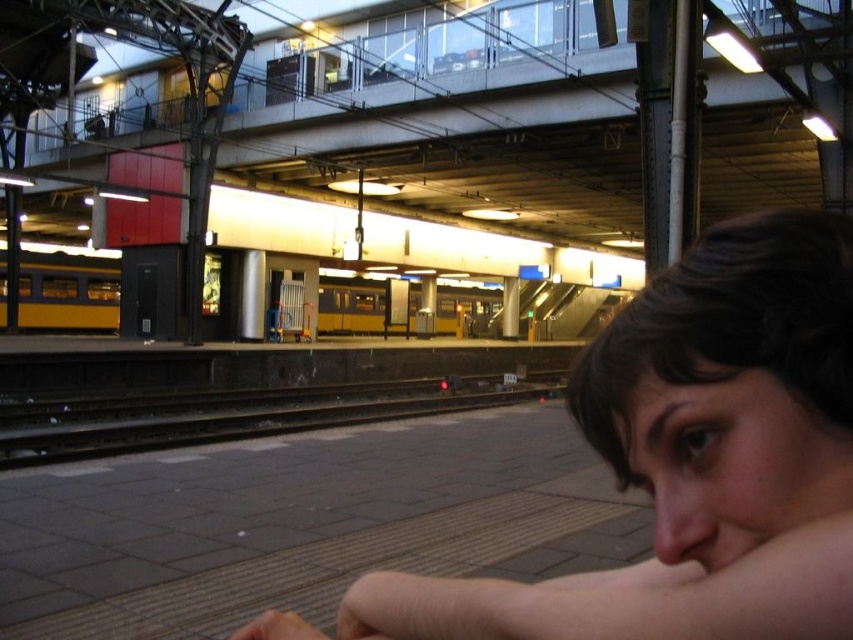
Question: Among these points, which one is farthest from the camera?

Choices:
 (A) (339, 308)
 (B) (651, 477)

Answer: (A)

Question: Can you confirm if dark brown hair at center is wider than black metal train track at center?

Choices:
 (A) yes
 (B) no

Answer: (B)

Question: Which of these objects is positioned closest to the yellow matte train at center?

Choices:
 (A) black metal train track at center
 (B) dark brown hair at center

Answer: (A)

Question: Is dark brown hair at center above yellow matte train at center?

Choices:
 (A) no
 (B) yes

Answer: (A)

Question: Does black metal train track at center have a greater width compared to yellow matte train at center?

Choices:
 (A) yes
 (B) no

Answer: (B)

Question: Estimate the real-world distances between objects in this image. Which object is farther from the dark brown hair at center?

Choices:
 (A) yellow matte train at center
 (B) black metal train track at center

Answer: (A)